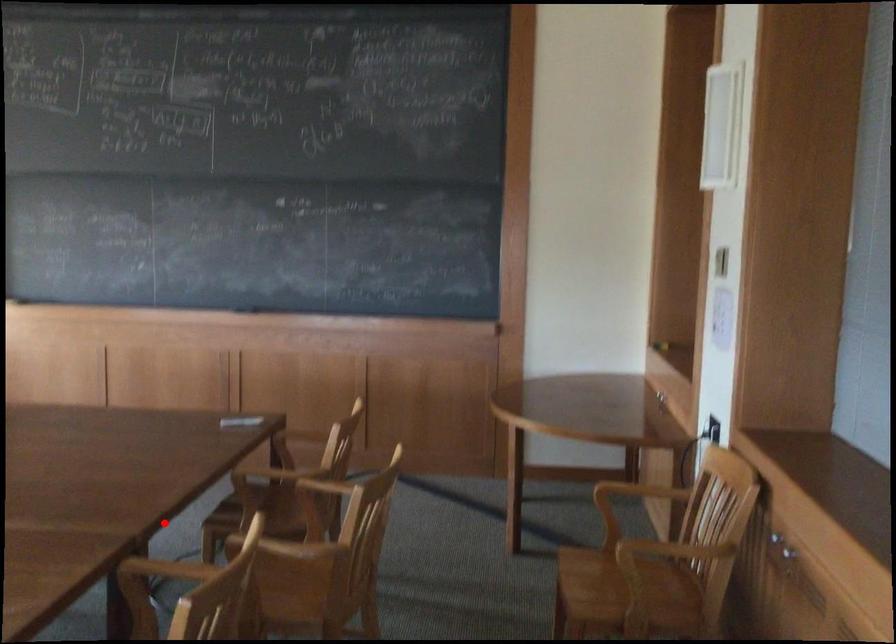
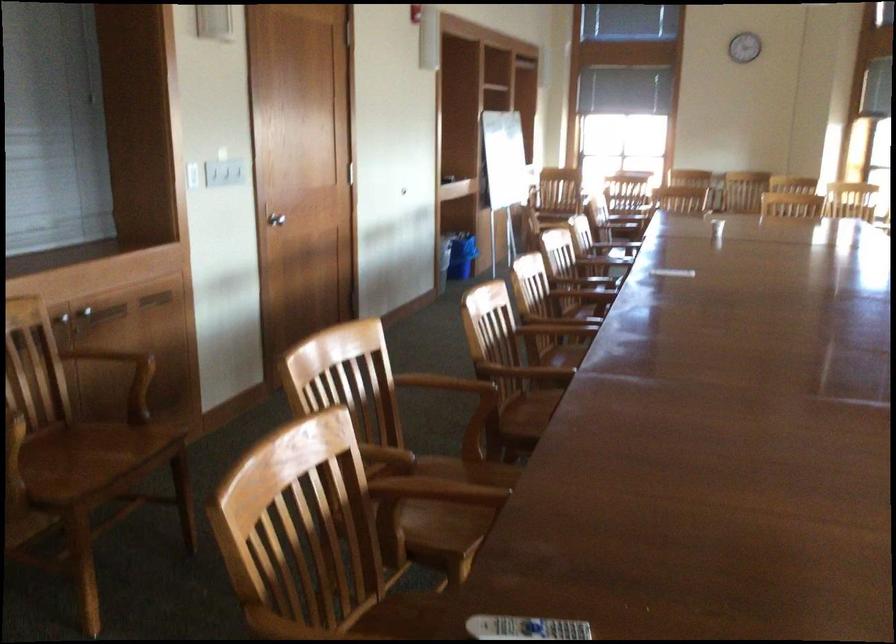
Question: I am providing you with two images of the same scene from different viewpoints. Given a red point in image1, look at the same physical point in image2. Is it:

Choices:
 (A) Closer to the viewpoint
 (B) Farther from the viewpoint

Answer: (A)